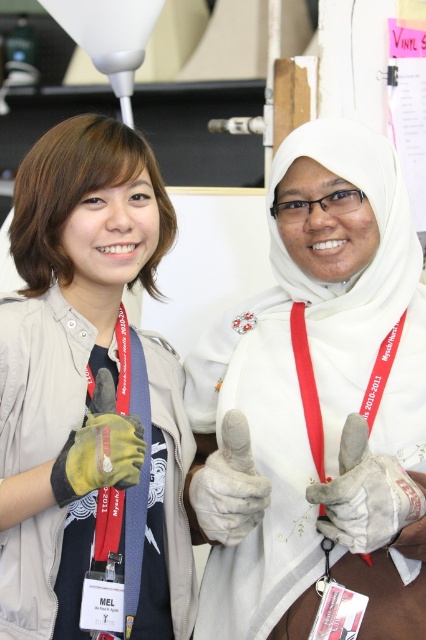
Question: Can you confirm if white matte gloves at center is wider than red fabric lanyard at center?

Choices:
 (A) no
 (B) yes

Answer: (B)

Question: Which point is closer to the camera?

Choices:
 (A) red fabric lanyard at center
 (B) matte gray jacket at center
 (C) white matte gloves at center

Answer: (B)

Question: Does white matte gloves at center have a smaller size compared to red fabric lanyard at center?

Choices:
 (A) no
 (B) yes

Answer: (A)

Question: Which point is closer to the camera taking this photo?

Choices:
 (A) (54, 538)
 (B) (319, 410)
 (C) (368, 196)

Answer: (A)

Question: Does white matte gloves at center appear on the left side of matte gray jacket at center?

Choices:
 (A) no
 (B) yes

Answer: (A)

Question: Which point is closer to the camera taking this photo?

Choices:
 (A) (383, 221)
 (B) (365, 403)

Answer: (B)